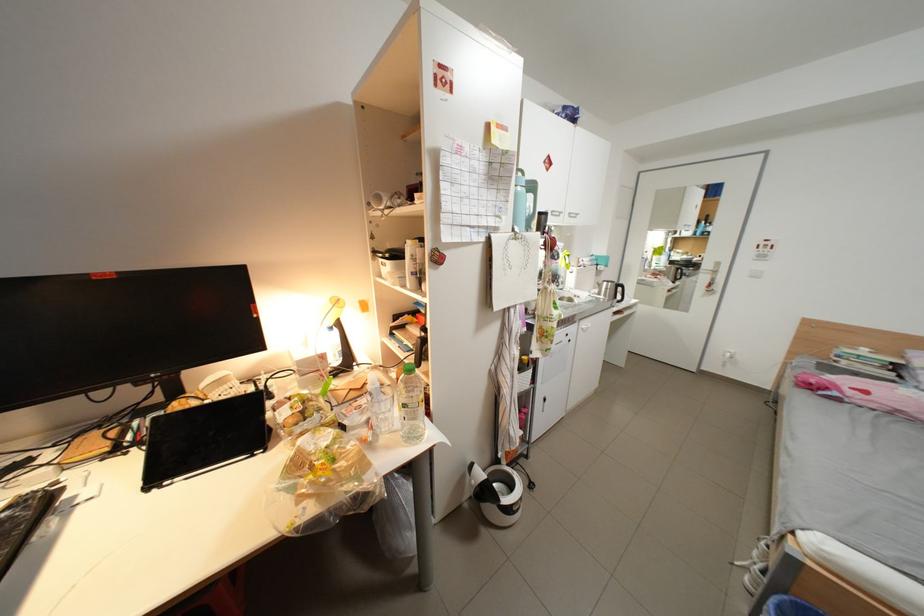
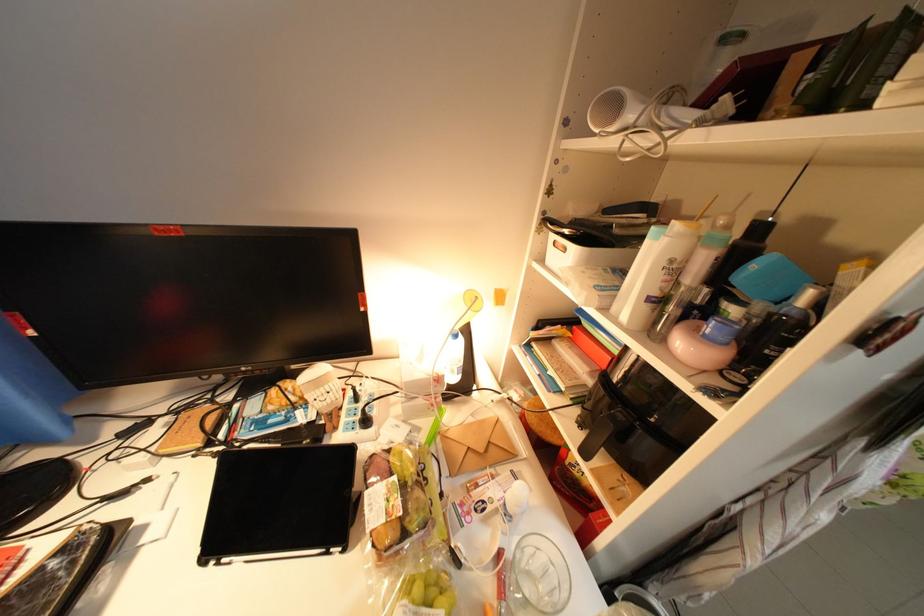
Question: The images are taken continuously from a first-person perspective. In which direction is your viewpoint rotating?

Choices:
 (A) Left
 (B) Right
 (C) Up
 (D) Down

Answer: (A)